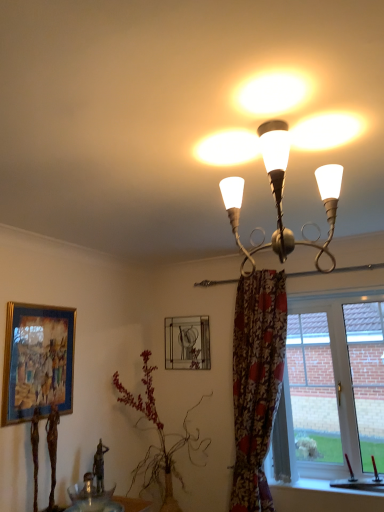
Question: Is clear glass window at lower right oriented away from floral fabric curtain at right?

Choices:
 (A) no
 (B) yes

Answer: (A)

Question: Does clear glass window at lower right touch floral fabric curtain at right?

Choices:
 (A) no
 (B) yes

Answer: (A)

Question: Does clear glass window at lower right have a greater height compared to floral fabric curtain at right?

Choices:
 (A) no
 (B) yes

Answer: (A)

Question: Does clear glass window at lower right appear on the right side of floral fabric curtain at right?

Choices:
 (A) yes
 (B) no

Answer: (A)

Question: From a real-world perspective, is clear glass window at lower right positioned under floral fabric curtain at right based on gravity?

Choices:
 (A) no
 (B) yes

Answer: (A)

Question: Based on their positions, is floral fabric curtain at right located to the left or right of metallic silver picture frame at upper center, the second picture frame viewed from the front?

Choices:
 (A) left
 (B) right

Answer: (B)

Question: From a real-world perspective, is floral fabric curtain at right physically located above or below metallic silver picture frame at upper center, positioned as the 2th picture frame in left-to-right order?

Choices:
 (A) above
 (B) below

Answer: (B)

Question: From the image's perspective, is floral fabric curtain at right located above or below metallic silver picture frame at upper center, the second picture frame viewed from the front?

Choices:
 (A) below
 (B) above

Answer: (A)

Question: Looking at the image, does floral fabric curtain at right seem bigger or smaller compared to metallic silver picture frame at upper center, which is counted as the 1th picture frame, starting from the back?

Choices:
 (A) small
 (B) big

Answer: (B)

Question: Would you say transparent glass bowl at lower left is to the left or to the right of translucent glass bowl at lower center in the picture?

Choices:
 (A) right
 (B) left

Answer: (B)

Question: In the image, is transparent glass bowl at lower left positioned in front of or behind translucent glass bowl at lower center?

Choices:
 (A) front
 (B) behind

Answer: (B)

Question: In terms of height, does transparent glass bowl at lower left look taller or shorter compared to translucent glass bowl at lower center?

Choices:
 (A) tall
 (B) short

Answer: (A)

Question: Is transparent glass bowl at lower left wider or thinner than translucent glass bowl at lower center?

Choices:
 (A) wide
 (B) thin

Answer: (B)

Question: Considering the relative positions of floral fabric curtain at right and transparent glass bowl at lower left in the image provided, is floral fabric curtain at right to the left or to the right of transparent glass bowl at lower left?

Choices:
 (A) left
 (B) right

Answer: (B)

Question: From the image's perspective, relative to transparent glass bowl at lower left, is floral fabric curtain at right above or below?

Choices:
 (A) above
 (B) below

Answer: (A)